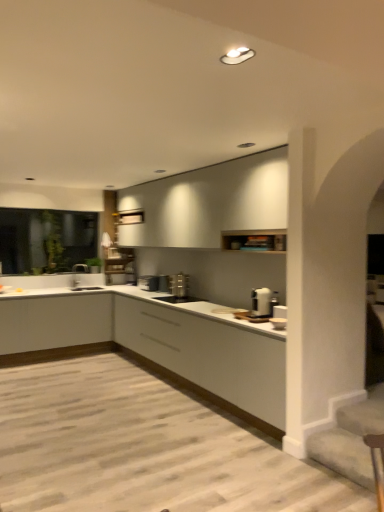
Question: Which direction should I rotate to face satin silver toaster at center, placed as the 1th appliance when sorted from back to front, — up or down?

Choices:
 (A) up
 (B) down

Answer: (B)

Question: Is white matte cabinet at lower left, the 2th cabinetry from the bottom, a part of white glossy toaster at center, the first appliance in the front-to-back sequence?

Choices:
 (A) no
 (B) yes

Answer: (A)

Question: Does white glossy toaster at center, which is the fourth appliance from left to right, have a smaller size compared to white matte cabinet at lower left, the 2th cabinetry from the bottom?

Choices:
 (A) no
 (B) yes

Answer: (B)

Question: Does white glossy toaster at center, the first appliance viewed from the right, lie behind white matte cabinet at lower left, the 2th cabinetry from the bottom?

Choices:
 (A) no
 (B) yes

Answer: (A)

Question: Is white glossy toaster at center, which is the fourth appliance from left to right, next to white matte cabinet at lower left, the 2th cabinetry from the bottom, and touching it?

Choices:
 (A) yes
 (B) no

Answer: (B)

Question: Does white glossy toaster at center, the first appliance viewed from the right, have a lesser height compared to white matte cabinet at lower left, the 2th cabinetry from the bottom?

Choices:
 (A) no
 (B) yes

Answer: (B)

Question: Considering the relative positions of white glossy toaster at center, which is the fourth appliance from left to right, and white matte cabinet at lower left, arranged as the second cabinetry when viewed from the top, in the image provided, is white glossy toaster at center, which is the fourth appliance from left to right, to the left of white matte cabinet at lower left, arranged as the second cabinetry when viewed from the top, from the viewer's perspective?

Choices:
 (A) no
 (B) yes

Answer: (A)

Question: Can you confirm if satin silver toaster at center, which is the third appliance from left to right, is smaller than satin silver toaster at center, placed as the 1th appliance when sorted from back to front?

Choices:
 (A) no
 (B) yes

Answer: (A)

Question: Is satin silver toaster at center, which is counted as the 3th appliance, starting from the front, far away from satin silver toaster at center, the fourth appliance viewed from the front?

Choices:
 (A) yes
 (B) no

Answer: (B)

Question: Does satin silver toaster at center, acting as the 2th appliance starting from the back, have a larger size compared to satin silver toaster at center, acting as the fourth appliance starting from the right?

Choices:
 (A) no
 (B) yes

Answer: (B)

Question: Is satin silver toaster at center, marked as the second appliance in a right-to-left arrangement, taller than satin silver toaster at center, which is the first appliance in left-to-right order?

Choices:
 (A) no
 (B) yes

Answer: (B)

Question: Is satin silver toaster at center, which is the third appliance from left to right, at the left side of satin silver toaster at center, acting as the fourth appliance starting from the right?

Choices:
 (A) yes
 (B) no

Answer: (B)

Question: Is satin silver toaster at center, which is counted as the 3th appliance, starting from the front, facing towards satin silver toaster at center, which is the first appliance in left-to-right order?

Choices:
 (A) no
 (B) yes

Answer: (A)

Question: Is white matte cabinet at lower left, the 2th cabinetry from the bottom, located within black matte sink at center, which is the third appliance from back to front?

Choices:
 (A) yes
 (B) no

Answer: (B)